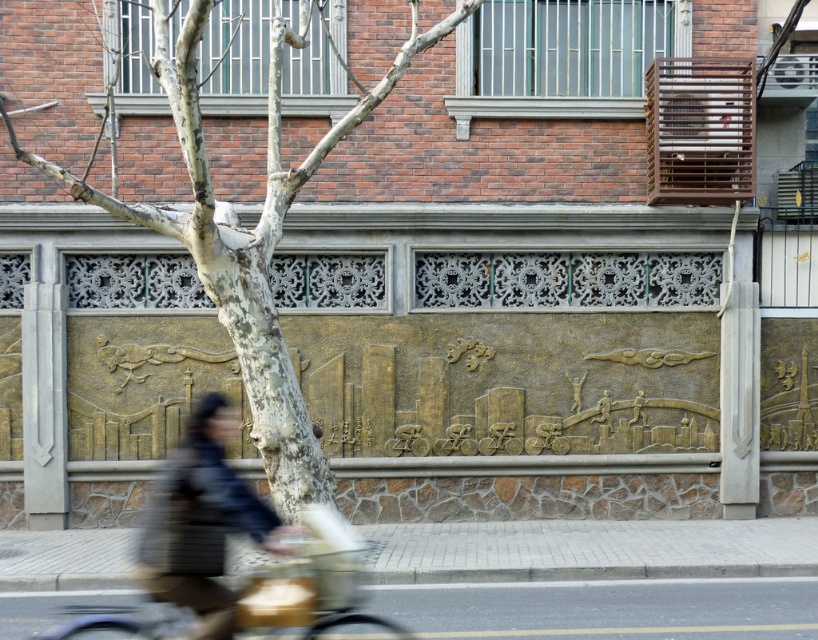
Can you confirm if smooth bark tree at center is positioned to the right of matte black jacket at lower left?

Indeed, smooth bark tree at center is positioned on the right side of matte black jacket at lower left.

Can you confirm if smooth bark tree at center is bigger than matte black jacket at lower left?

Yes.

Locate an element on the screen. smooth bark tree at center is located at coordinates (246, 230).

Image resolution: width=818 pixels, height=640 pixels. What are the coordinates of `smooth bark tree at center` in the screenshot? It's located at (246, 230).

Is smooth bark tree at center bigger than gold metallic bicycle at lower left?

A: Correct, smooth bark tree at center is larger in size than gold metallic bicycle at lower left.

Who is shorter, smooth bark tree at center or gold metallic bicycle at lower left?

Standing shorter between the two is gold metallic bicycle at lower left.

Describe the element at coordinates (246, 230) in the screenshot. I see `smooth bark tree at center` at that location.

You are a GUI agent. You are given a task and a screenshot of the screen. Output one action in this format:
    pyautogui.click(x=<x>, y=<y>)
    Task: Click on the smooth bark tree at center
    This screenshot has width=818, height=640.
    Given the screenshot: What is the action you would take?
    pyautogui.click(x=246, y=230)

Is the position of matte black jacket at lower left less distant than that of gold metallic bicycle at lower left?

No, it is not.

Where is `matte black jacket at lower left`? The height and width of the screenshot is (640, 818). matte black jacket at lower left is located at coordinates (201, 524).

Where is `matte black jacket at lower left`? Image resolution: width=818 pixels, height=640 pixels. matte black jacket at lower left is located at coordinates (201, 524).